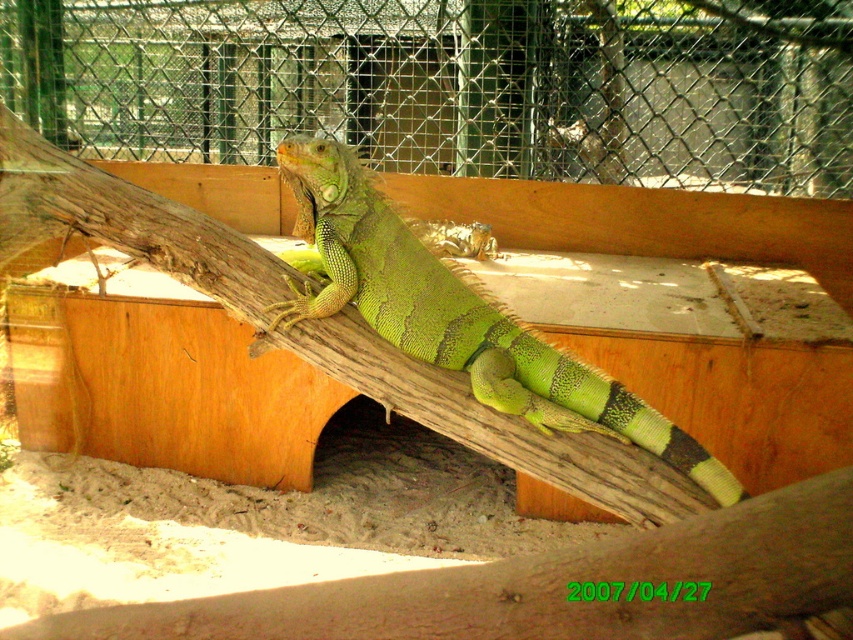
Find the location of a particular element. green mesh fence at upper center is located at coordinates (450, 84).

Between point (526, 29) and point (498, 340), which one is positioned behind?

Point (526, 29)

Locate an element on the screen. Image resolution: width=853 pixels, height=640 pixels. green mesh fence at upper center is located at coordinates (450, 84).